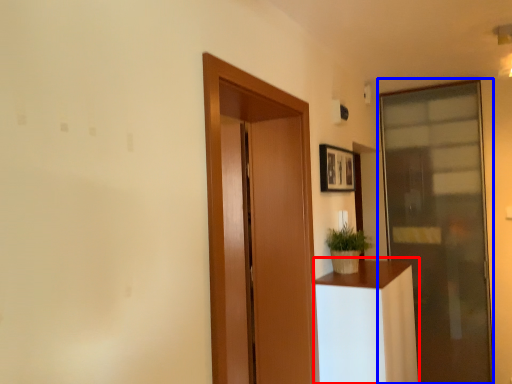
Question: Among these objects, which one is nearest to the camera, furniture (highlighted by a red box) or door (highlighted by a blue box)?

Choices:
 (A) furniture
 (B) door

Answer: (A)